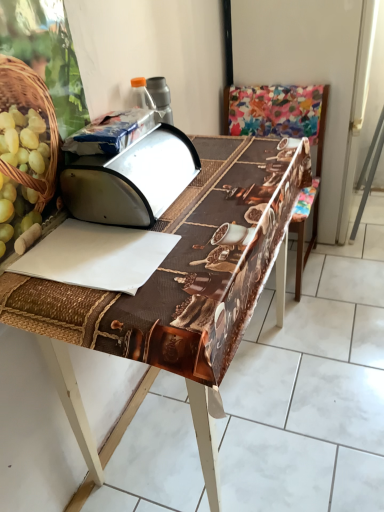
I want to click on vacant space to the right of metallic silver breadbox at center, so click(x=231, y=181).